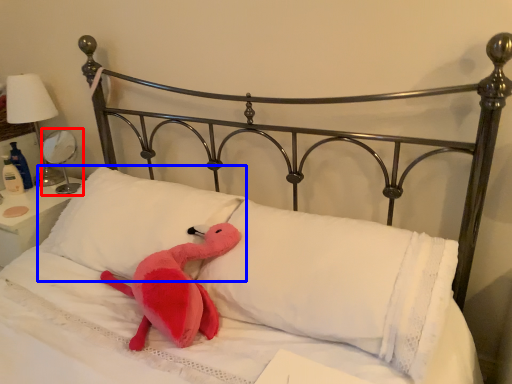
Question: Among these objects, which one is nearest to the camera, table lamp (highlighted by a red box) or pillow (highlighted by a blue box)?

Choices:
 (A) table lamp
 (B) pillow

Answer: (B)